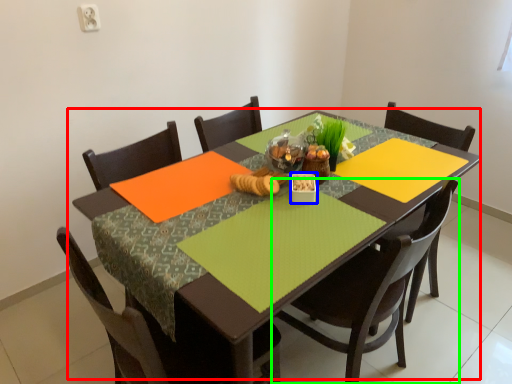
Question: Which object is positioned closest to table (highlighted by a red box)? Select from tableware (highlighted by a blue box) and chair (highlighted by a green box).

Choices:
 (A) tableware
 (B) chair

Answer: (B)